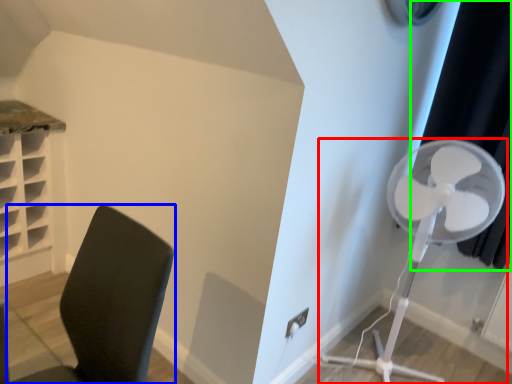
Question: Which is nearer to the mechanical fan (highlighted by a red box)? furniture (highlighted by a blue box) or curtain (highlighted by a green box).

Choices:
 (A) furniture
 (B) curtain

Answer: (B)